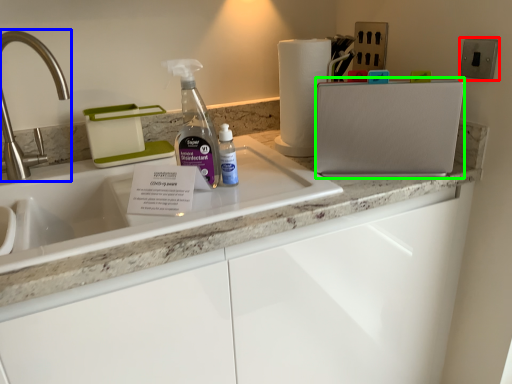
Question: Which is nearer to the electric outlet (highlighted by a red box)? tap (highlighted by a blue box) or appliance (highlighted by a green box).

Choices:
 (A) tap
 (B) appliance

Answer: (B)